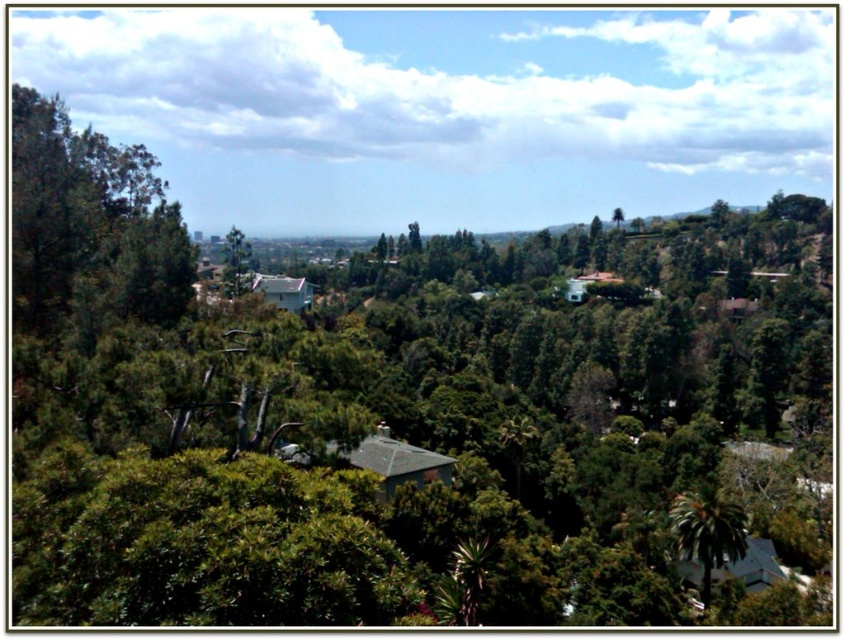
The width and height of the screenshot is (845, 640). Describe the element at coordinates (707, 531) in the screenshot. I see `green leafy palm tree at lower right` at that location.

Does point (726, 557) come closer to viewer compared to point (232, 262)?

Yes.

The height and width of the screenshot is (640, 845). I want to click on green leafy palm tree at lower right, so click(707, 531).

Is green leafy palm tree at lower right thinner than green leafy tree at upper center?

Indeed, green leafy palm tree at lower right has a lesser width compared to green leafy tree at upper center.

Which is behind, point (701, 572) or point (622, 221)?

The point (622, 221) is behind.

Image resolution: width=845 pixels, height=640 pixels. Find the location of `green leafy palm tree at lower right`. green leafy palm tree at lower right is located at coordinates (707, 531).

You are a GUI agent. You are given a task and a screenshot of the screen. Output one action in this format:
    pyautogui.click(x=<x>, y=<y>)
    Task: Click on the green leafy palm tree at lower right
    
    Given the screenshot: What is the action you would take?
    pyautogui.click(x=707, y=531)

Can you confirm if green leafy tree at center is positioned to the right of green leafy tree at upper center?

In fact, green leafy tree at center is to the left of green leafy tree at upper center.

Is green leafy tree at center taller than green leafy tree at upper center?

Correct, green leafy tree at center is much taller as green leafy tree at upper center.

Who is more forward, [247,276] or [620,209]?

Point [247,276] is more forward.

In order to click on green leafy tree at center in this screenshot , I will do `click(235, 262)`.